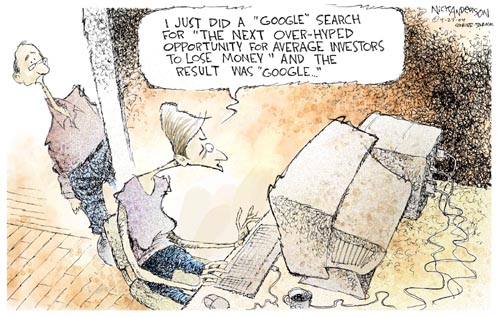
The image size is (500, 317). Identify the location of desktop computer monitor. (316, 171).